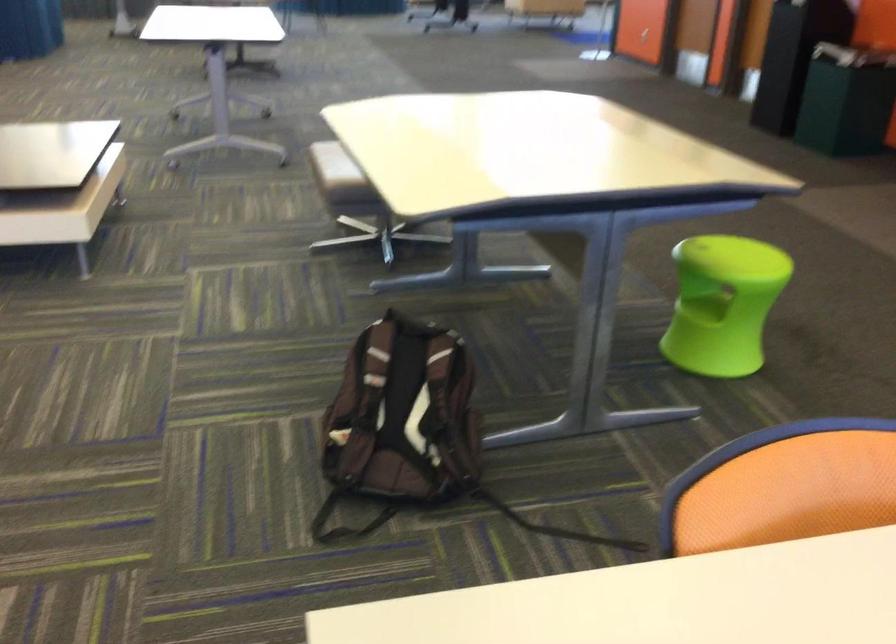
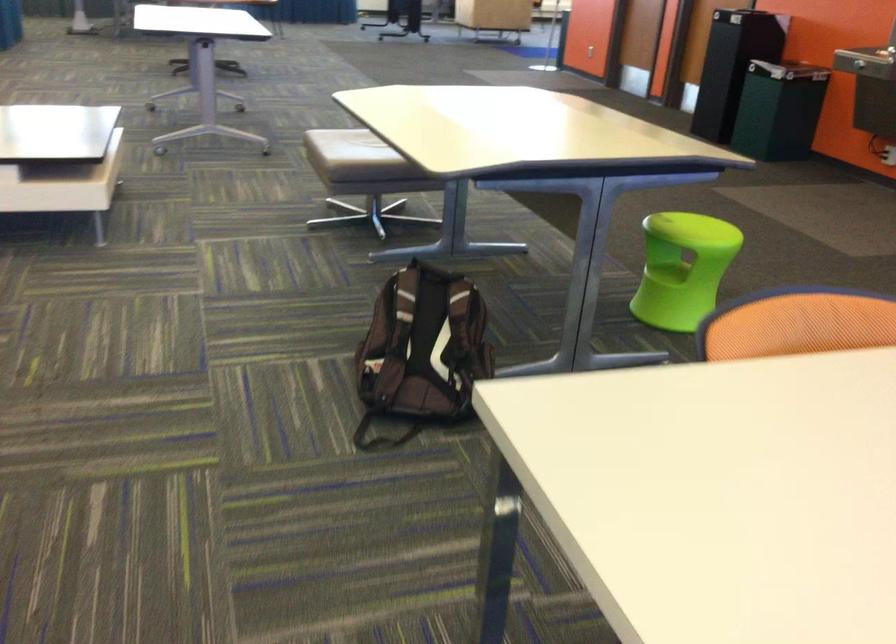
Question: The images are taken continuously from a first-person perspective. In which direction is your viewpoint rotating?

Choices:
 (A) Left
 (B) Right
 (C) Up
 (D) Down

Answer: (B)